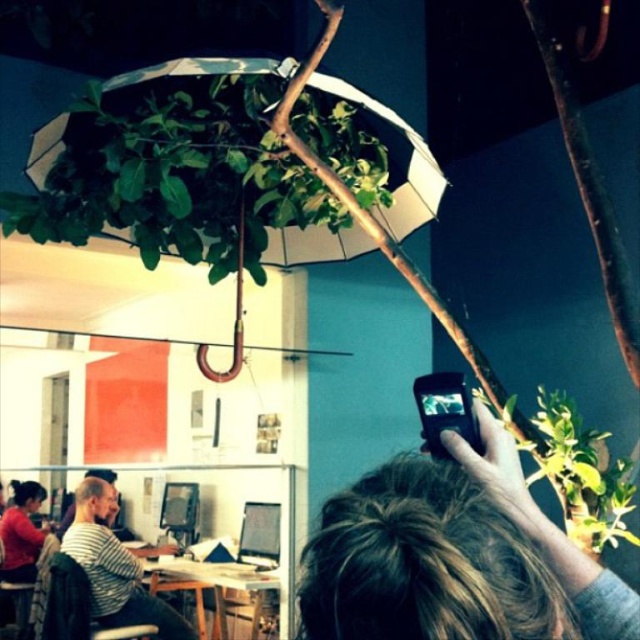
Question: Is striped cotton shirt at center thinner than wooden table at center?

Choices:
 (A) yes
 (B) no

Answer: (A)

Question: Which point is closer to the camera taking this photo?

Choices:
 (A) (116, 596)
 (B) (384, 209)

Answer: (B)

Question: Does white matte umbrella at upper center have a greater width compared to wooden table at center?

Choices:
 (A) yes
 (B) no

Answer: (A)

Question: Which is farther from the white matte umbrella at upper center?

Choices:
 (A) striped cotton shirt at center
 (B) wooden table at center

Answer: (B)

Question: Estimate the real-world distances between objects in this image. Which object is closer to the wooden table at center?

Choices:
 (A) white matte umbrella at upper center
 (B) striped cotton shirt at center

Answer: (B)

Question: Where is white matte umbrella at upper center located in relation to striped cotton shirt at center in the image?

Choices:
 (A) left
 (B) right

Answer: (B)